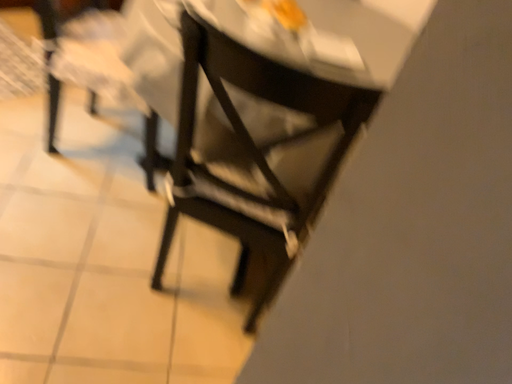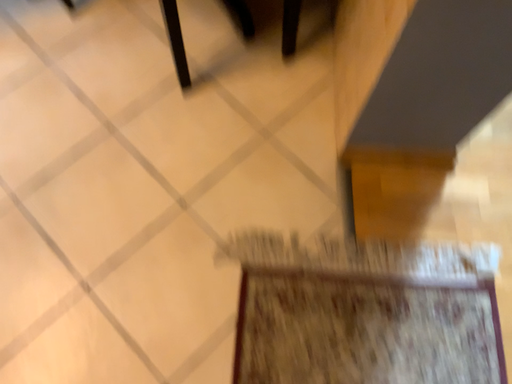
Question: How did the camera likely rotate when shooting the video?

Choices:
 (A) rotated left
 (B) rotated right

Answer: (B)